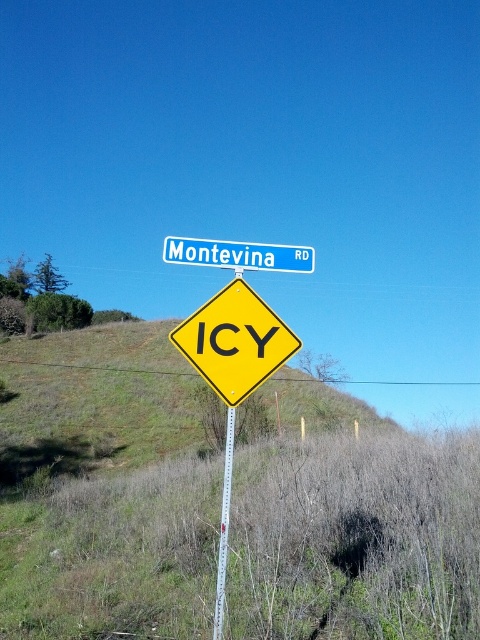
You are driving a car and see the blue metallic street sign at upper center and the metallic silver pole at center. Which one appears bigger in the scene?

The blue metallic street sign at upper center appears bigger than the metallic silver pole at center because it has a larger size compared to it.

You are a delivery driver approaching the yellow diamond road sign in the foreground. You need to locate the blue metallic street sign at upper center to confirm the road name. According to the scene, where should you look relative to the yellow diamond road sign?

The blue metallic street sign at upper center is positioned above the yellow diamond road sign, as it is located at point (239, 253) in the scene.